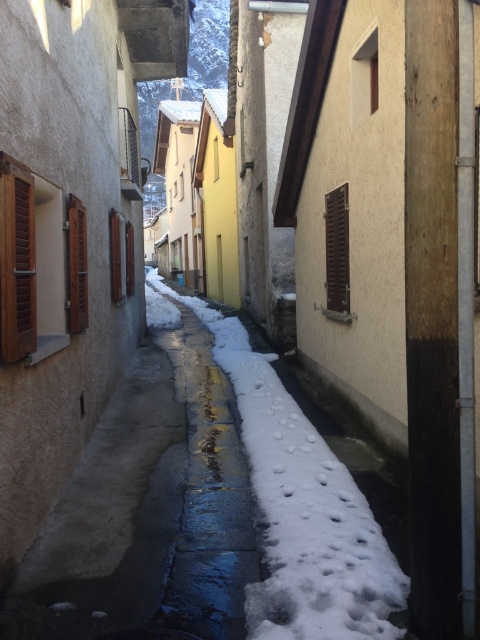
Question: Is brown wooden shutters at right smaller than brown wooden shutter at left?

Choices:
 (A) yes
 (B) no

Answer: (B)

Question: Which object is the closest to the brown wooden shutter at left?

Choices:
 (A) white fluffy snow at center
 (B) brown wooden shutters at right
 (C) brown wooden shutters at left
 (D) wooden at left

Answer: (A)

Question: Can you confirm if brown wooden shutters at right is positioned below brown wooden shutter at left?

Choices:
 (A) yes
 (B) no

Answer: (A)

Question: Is brown wooden shutters at right bigger than wooden at left?

Choices:
 (A) no
 (B) yes

Answer: (B)

Question: Which of these objects is positioned closest to the white fluffy snow at center?

Choices:
 (A) brown wooden shutter at left
 (B) brown wooden shutters at right
 (C) wooden at left

Answer: (B)

Question: Among these objects, which one is nearest to the camera?

Choices:
 (A) white fluffy snow at center
 (B) brown wooden shutter at left
 (C) wooden at left
 (D) brown wooden shutters at left

Answer: (A)